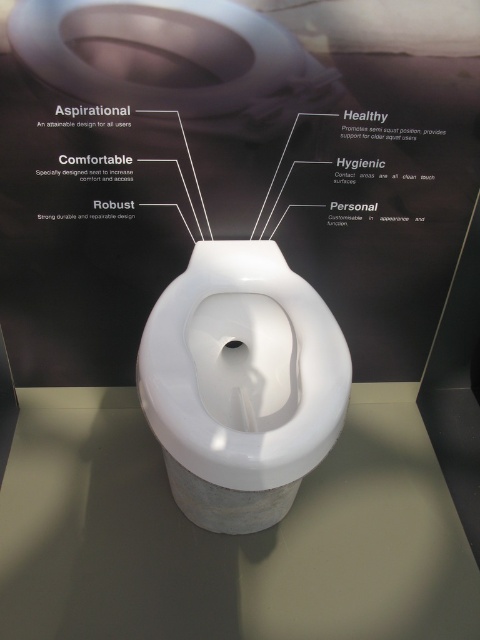
Question: Can you confirm if white glossy toilet bowl at center is positioned to the right of matte white toilet lid at upper center?

Choices:
 (A) yes
 (B) no

Answer: (A)

Question: Which point appears farthest from the camera in this image?

Choices:
 (A) (64, 140)
 (B) (15, 490)
 (C) (79, 60)

Answer: (B)

Question: Among these points, which one is nearest to the camera?

Choices:
 (A) (94, 160)
 (B) (139, 348)
 (C) (210, 102)
 (D) (360, 129)

Answer: (C)

Question: Which point is closer to the camera taking this photo?

Choices:
 (A) coord(372,557)
 (B) coord(395,148)
 (C) coord(154,1)
 (D) coord(411,337)

Answer: (C)

Question: Can you confirm if white glossy toilet at center is thinner than transparent glass table at center?

Choices:
 (A) no
 (B) yes

Answer: (B)

Question: Does white glossy toilet at center appear over white glossy toilet bowl at center?

Choices:
 (A) yes
 (B) no

Answer: (A)